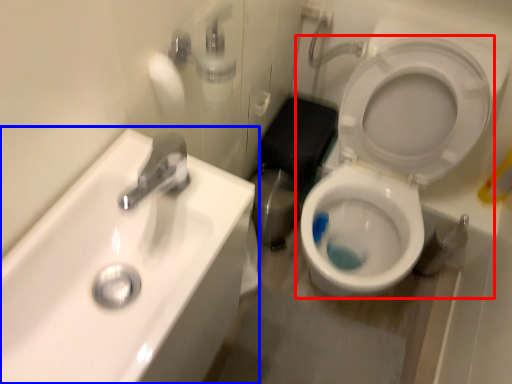
Question: Which point is further to the camera, toilet (highlighted by a red box) or sink (highlighted by a blue box)?

Choices:
 (A) toilet
 (B) sink

Answer: (A)